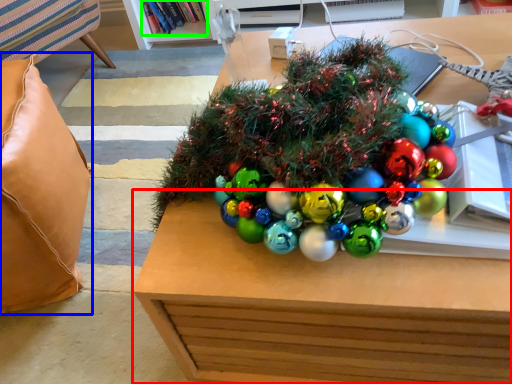
Question: Which object is positioned farthest from table (highlighted by a red box)? Select from pillow (highlighted by a blue box) and book (highlighted by a green box).

Choices:
 (A) pillow
 (B) book

Answer: (B)